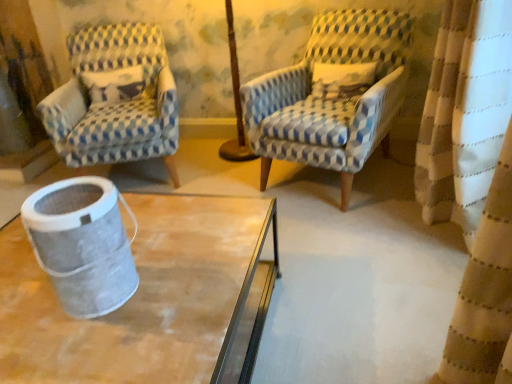
You are a GUI agent. You are given a task and a screenshot of the screen. Output one action in this format:
    pyautogui.click(x=<x>, y=<y>)
    Task: Click on the vacant space in blue and white checkered fabric armchair at left, the 2th chair positioned from the right (from a real-world perspective)
    The width and height of the screenshot is (512, 384).
    Given the screenshot: What is the action you would take?
    pyautogui.click(x=153, y=175)